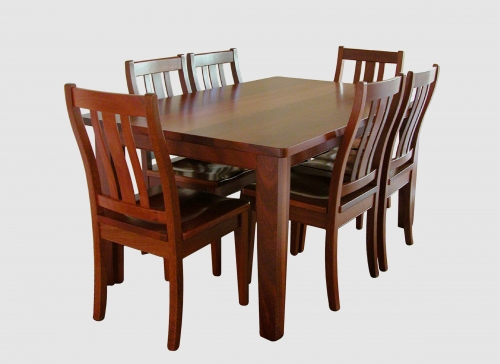
What are the coordinates of `chair` in the screenshot? It's located at (376, 92), (413, 88), (380, 57), (212, 63), (169, 60), (143, 101).